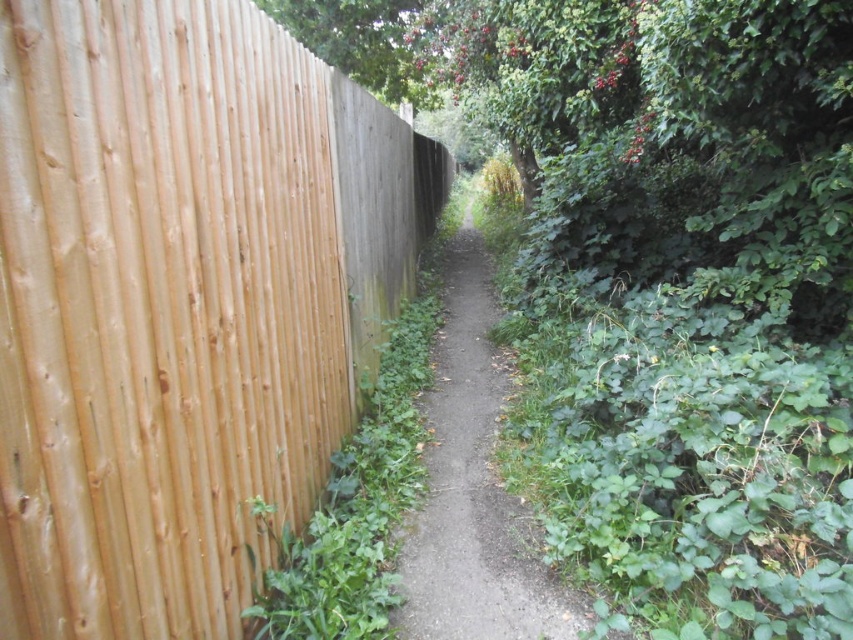
Which is in front, point (38, 550) or point (474, 294)?

Point (38, 550) is more forward.

How much distance is there between natural wood fence at left and dirt path at center?

natural wood fence at left is 1.56 meters away from dirt path at center.

Locate an element on the screen. This screenshot has width=853, height=640. natural wood fence at left is located at coordinates (181, 301).